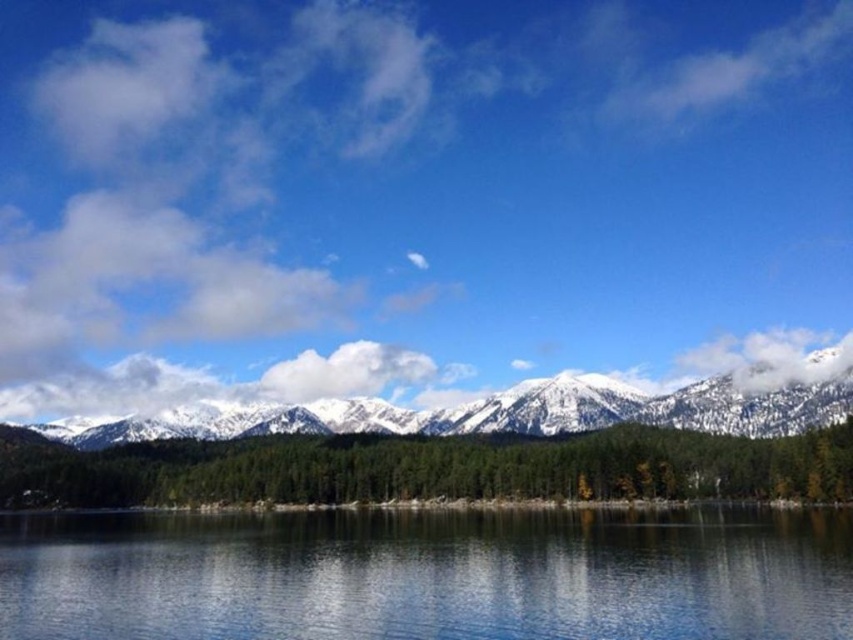
Between transparent glass water at center and snowy white mountain range at center, which one has less height?

transparent glass water at center

Who is taller, transparent glass water at center or snowy white mountain range at center?

snowy white mountain range at center is taller.

Where is `transparent glass water at center`? The image size is (853, 640). transparent glass water at center is located at coordinates (428, 573).

At what (x,y) coordinates should I click in order to perform the action: click on transparent glass water at center. Please return your answer as a coordinate pair (x, y). Image resolution: width=853 pixels, height=640 pixels. Looking at the image, I should click on (428, 573).